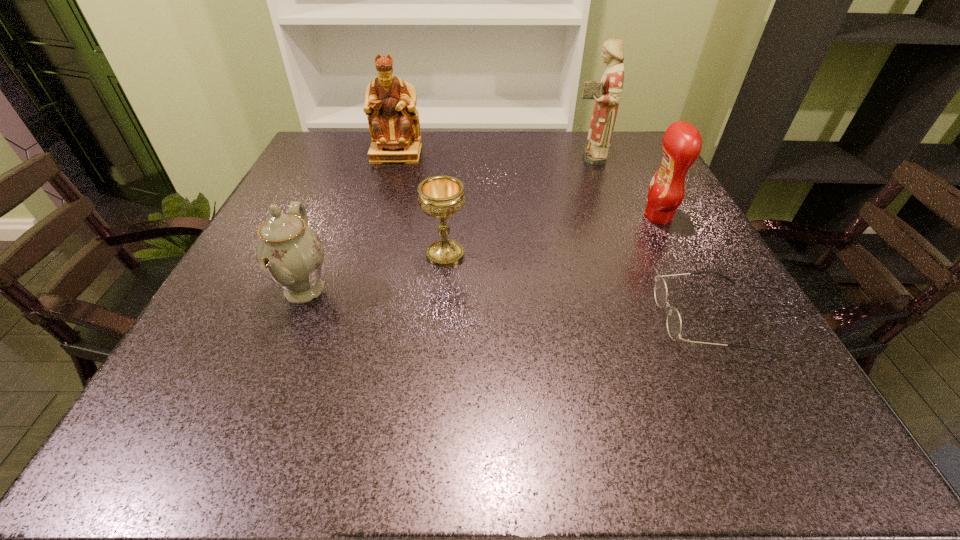
I want to click on free region at the far right corner of the desktop, so click(624, 154).

Identify the location of unoccupied area between the right figurine and the fifth shortest object. (492, 155).

This screenshot has height=540, width=960. Identify the location of vacant area that lies between the taller figurine and the chalice. (516, 206).

Find the location of `vacant area that lies between the taller figurine and the shorter figurine`. vacant area that lies between the taller figurine and the shorter figurine is located at coordinates (492, 155).

Locate an element on the screen. The image size is (960, 540). vacant region between the spectacles and the right figurine is located at coordinates (648, 238).

This screenshot has height=540, width=960. I want to click on vacant space that is in between the right figurine and the condiment, so [x=623, y=187].

The width and height of the screenshot is (960, 540). I want to click on vacant area that lies between the spectacles and the chalice, so click(x=576, y=286).

This screenshot has width=960, height=540. Identify the location of unoccupied position between the fifth tallest object and the chinaware. (374, 272).

Find the location of a particular element. The height and width of the screenshot is (540, 960). vacant area that lies between the left figurine and the shortest object is located at coordinates (552, 236).

Identify which object is the second closest to the right figurine. Please provide its 2D coordinates. Your answer should be formatted as a tuple, i.e. [(x, y)], where the tuple contains the x and y coordinates of a point satisfying the conditions above.

[(390, 102)]